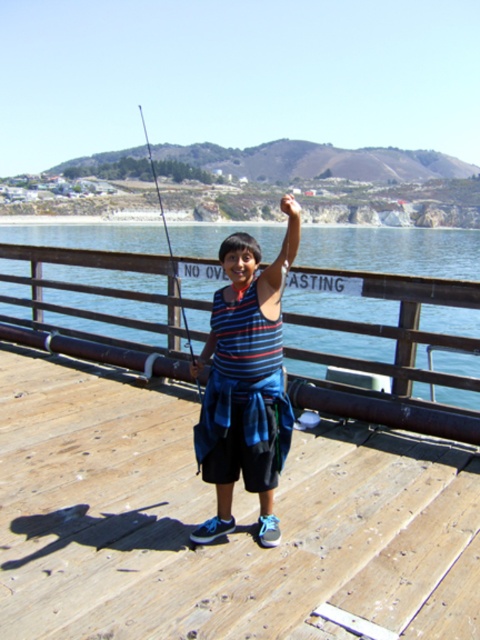
You are a drone operator trying to capture a photo of the wooden dock at center. The drone needs to hover exactly above the coordinates provided in the Objects Description. What coordinates should the drone hover at?

The drone should hover at coordinates point [211,513] to capture the wooden dock at center.

You are standing at the point marked as point (211, 513). Which object is exactly at your current location?

The wooden dock at center is exactly at your current location at point (211, 513).

You are a drone operator trying to capture a photo of the wooden dock at center. The drone is currently at point (211,513). Is the drone positioned directly above the wooden dock at center?

The wooden dock at center is located at point (211,513), so yes, the drone is positioned directly above the wooden dock at center.